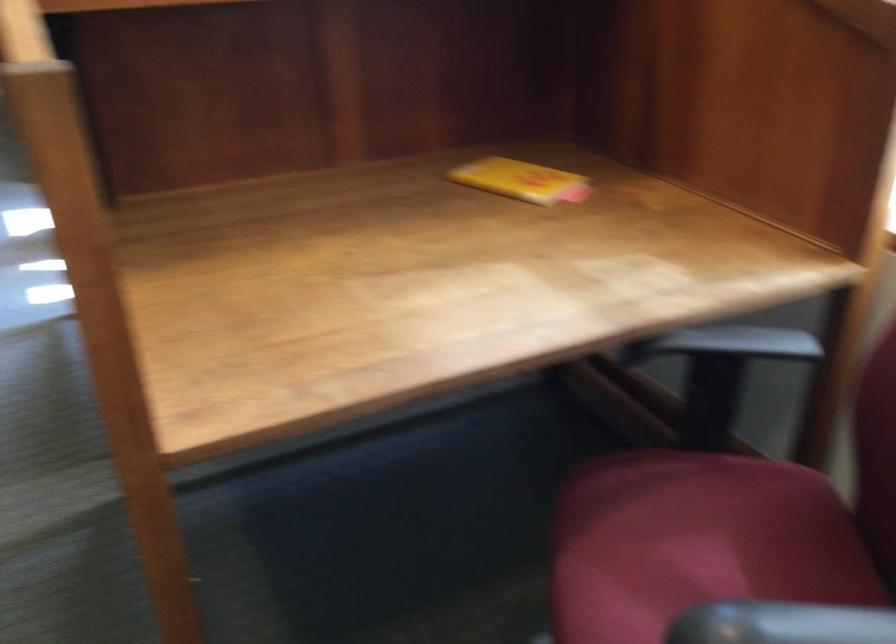
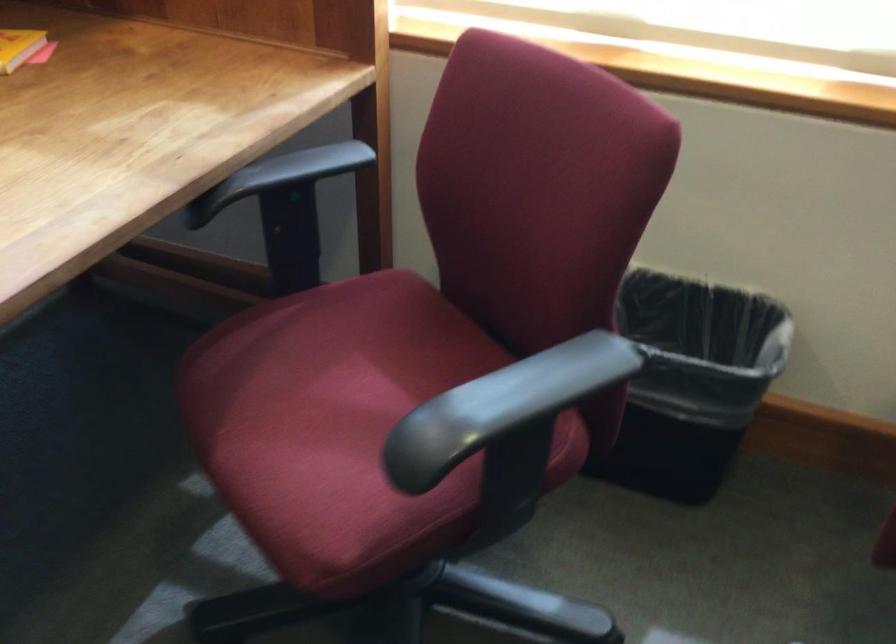
Question: The camera is either moving clockwise (left) or counter-clockwise (right) around the object. The first image is from the beginning of the video and the second image is from the end. Is the camera moving left or right when shooting the video?

Choices:
 (A) Left
 (B) Right

Answer: (A)